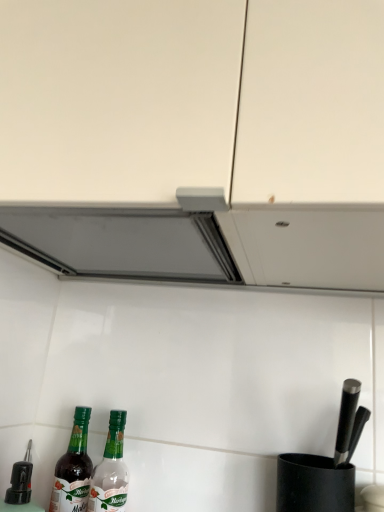
Question: From the image's perspective, is green glass bottle at lower left, the 2th bottle from the right, above or below green glass bottle at lower left, which appears as the second bottle when viewed from the left?

Choices:
 (A) above
 (B) below

Answer: (A)

Question: From a real-world perspective, is green glass bottle at lower left, marked as the first bottle in a left-to-right arrangement, above or below green glass bottle at lower left, which appears as the second bottle when viewed from the left?

Choices:
 (A) above
 (B) below

Answer: (B)

Question: Considering the positions of green glass bottle at lower left, the 2th bottle from the right, and green glass bottle at lower left, which is the first bottle in right-to-left order, in the image, is green glass bottle at lower left, the 2th bottle from the right, taller or shorter than green glass bottle at lower left, which is the first bottle in right-to-left order,?

Choices:
 (A) short
 (B) tall

Answer: (A)

Question: Is green glass bottle at lower left, which is the first bottle in right-to-left order, in front of or behind green glass bottle at lower left, the 2th bottle from the right, in the image?

Choices:
 (A) front
 (B) behind

Answer: (A)

Question: Is green glass bottle at lower left, which is the first bottle in right-to-left order, inside or outside of green glass bottle at lower left, the 2th bottle from the right?

Choices:
 (A) inside
 (B) outside

Answer: (B)

Question: Considering the relative positions of green glass bottle at lower left, which appears as the second bottle when viewed from the left, and green glass bottle at lower left, the 2th bottle from the right, in the image provided, is green glass bottle at lower left, which appears as the second bottle when viewed from the left, to the left or to the right of green glass bottle at lower left, the 2th bottle from the right,?

Choices:
 (A) left
 (B) right

Answer: (B)

Question: In terms of height, does green glass bottle at lower left, which appears as the second bottle when viewed from the left, look taller or shorter compared to green glass bottle at lower left, the 2th bottle from the right?

Choices:
 (A) short
 (B) tall

Answer: (B)